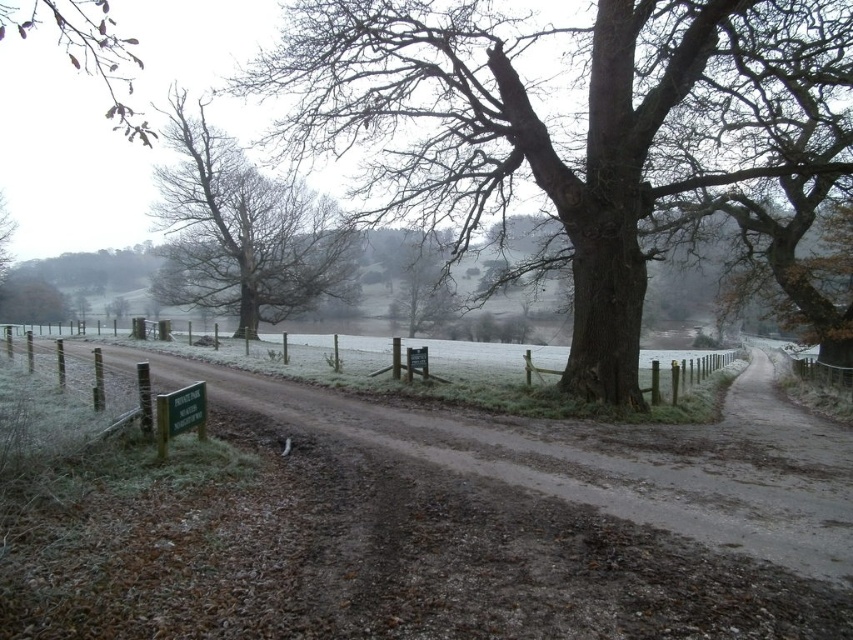
You are an artist planning to paint the scene of the brown rough bark tree at center and the smooth brown tree at center. Which tree should you focus on if you want to depict the larger one in your painting?

The brown rough bark tree at center is larger in size than the smooth brown tree at center, so you should focus on the brown rough bark tree at center for your painting.

You are standing on the dirt road in the rural landscape and see the point marked at coordinates [566,124]. What does this point indicate?

The point at [566,124] marks the location of the brown rough bark tree at center in the image.